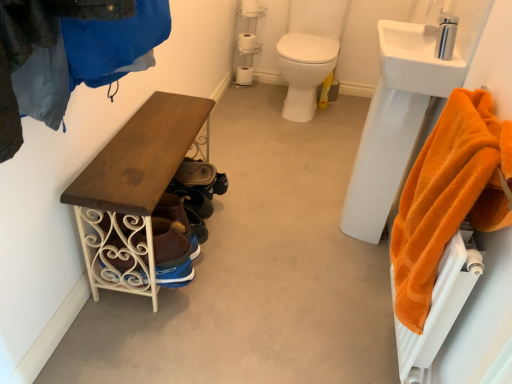
Locate an element on the screen. The width and height of the screenshot is (512, 384). free space below orange plush towel at right (from a real-world perspective) is located at coordinates (377, 336).